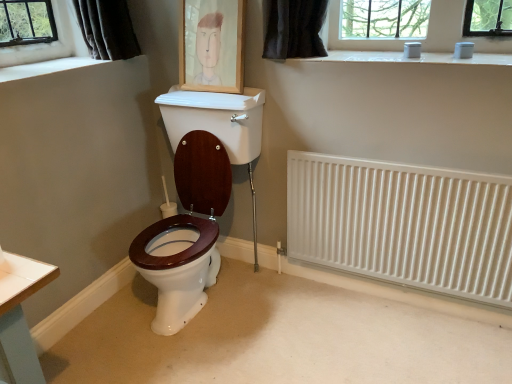
This screenshot has height=384, width=512. I want to click on vacant region to the left of white metallic radiator at right, so click(x=285, y=319).